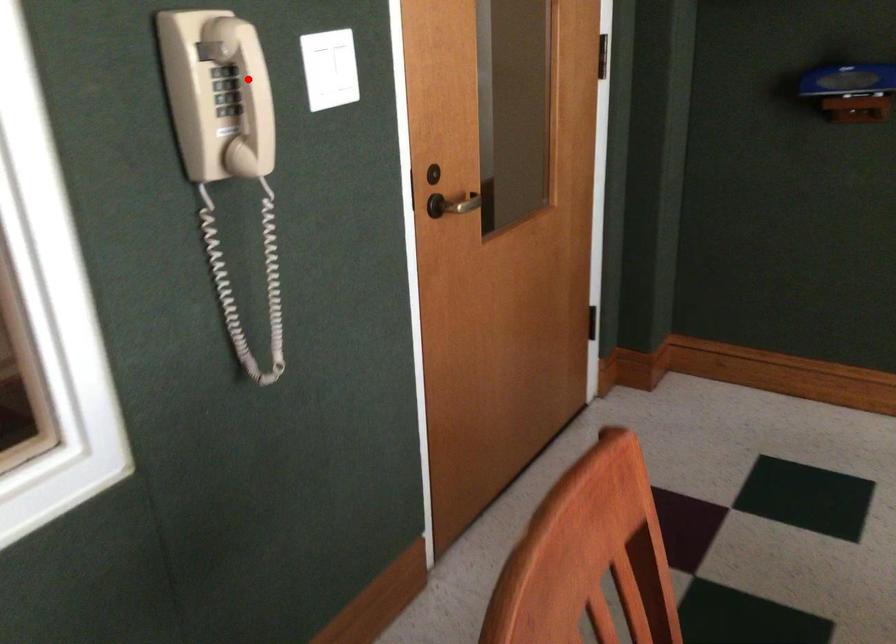
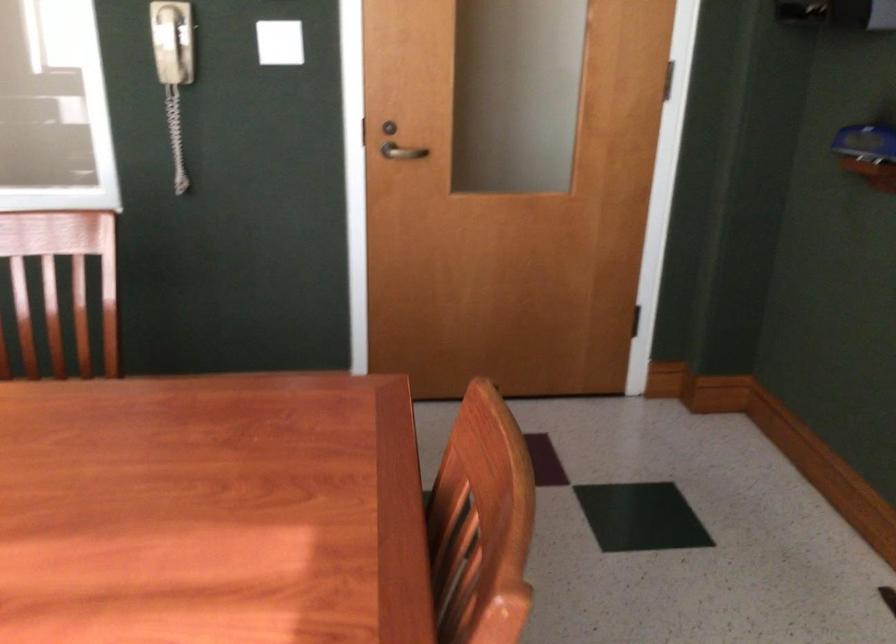
Question: I am providing you with two images of the same scene from different viewpoints. Image1 has a red point marked. In image2, the corresponding 3D location appears at what relative position? Reply with the corresponding letter.

Choices:
 (A) Closer
 (B) Farther

Answer: (B)